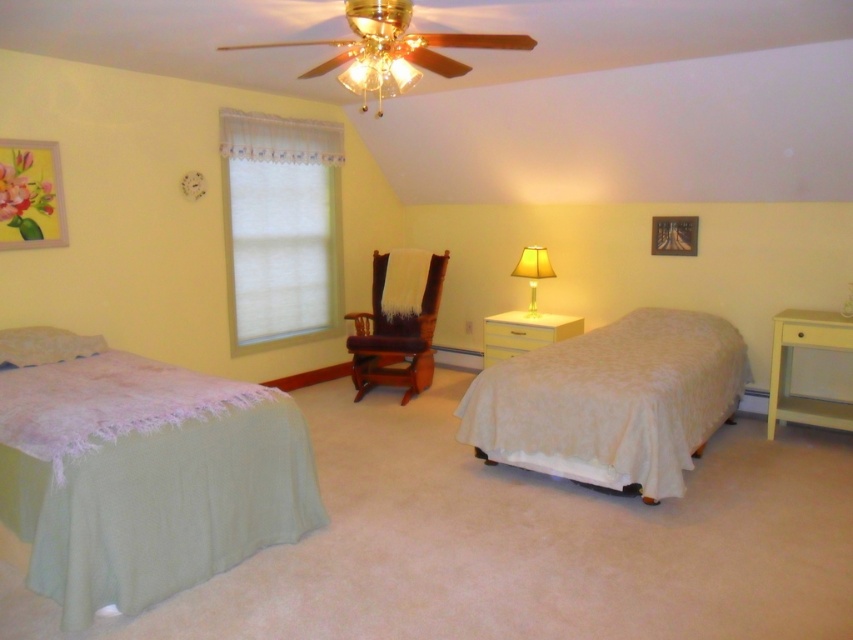
You are standing in the middle of the bedroom and want to move towards the point that is closer to the window. Which point should you head towards, point (375, 378) or point (500, 330)?

Point (375, 378) is in front of point (500, 330), so it is closer to you. Since you are standing in the middle of the bedroom, moving towards point (375, 378) would bring you closer to the window.

You are a guest in this bedroom and want to sit on the white textured bed at center. To reach it, you must pass by the white glossy dresser at center. Are you able to walk directly to the bed without going around the dresser?

The white textured bed at center is located below the white glossy dresser at center, meaning the dresser is above it. Since the dresser is positioned above the bed, you can walk directly to the bed without needing to go around the dresser as they are vertically aligned.

You are a guest in this bedroom and want to sit down. You see the brown leather armchair at center and the white soft pillow at lower left. Which one can you sit on?

The brown leather armchair at center is larger in size compared to the white soft pillow at lower left, so you can sit on the brown leather armchair at center.